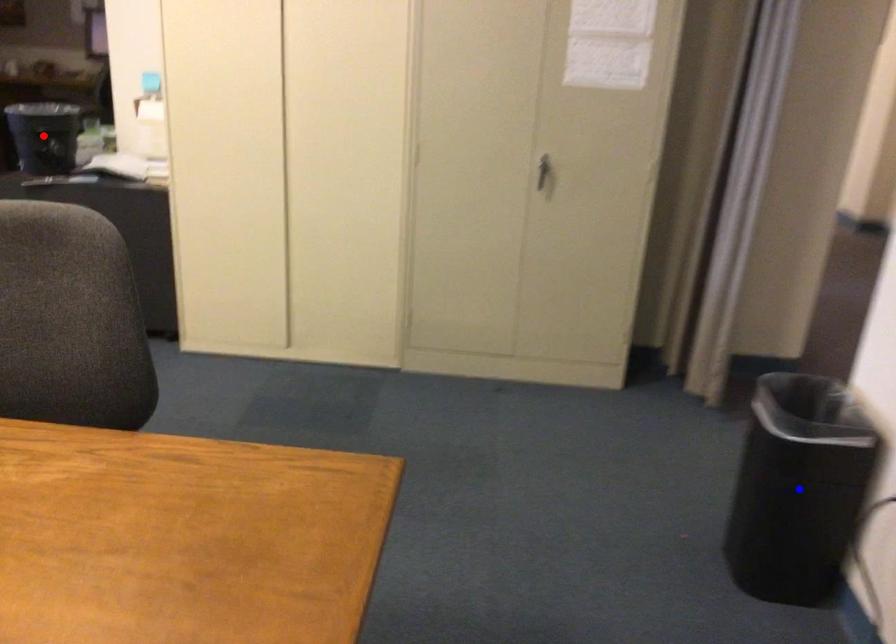
Question: In the image, two points are highlighted. Which point is nearer to the camera? Reply with the corresponding letter.

Choices:
 (A) blue point
 (B) red point

Answer: (A)